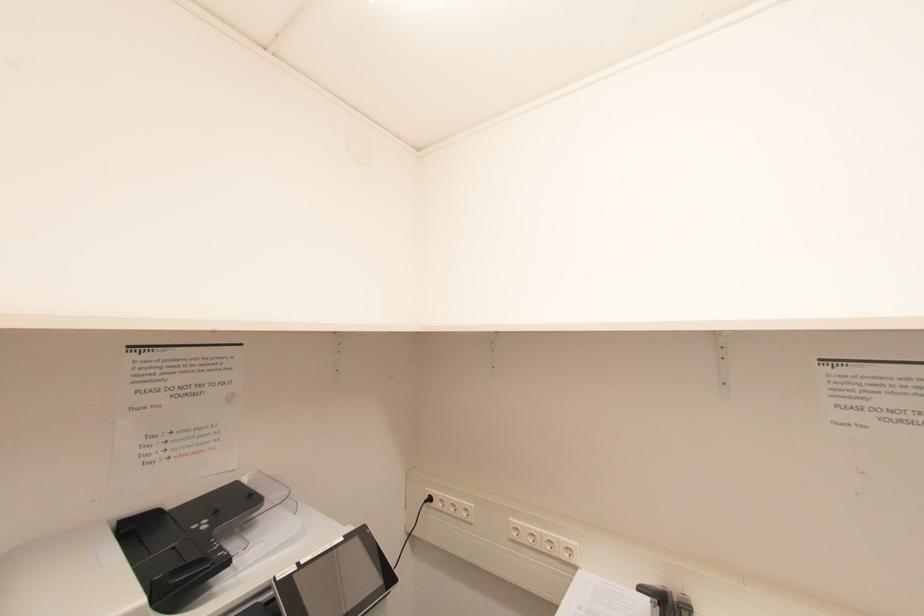
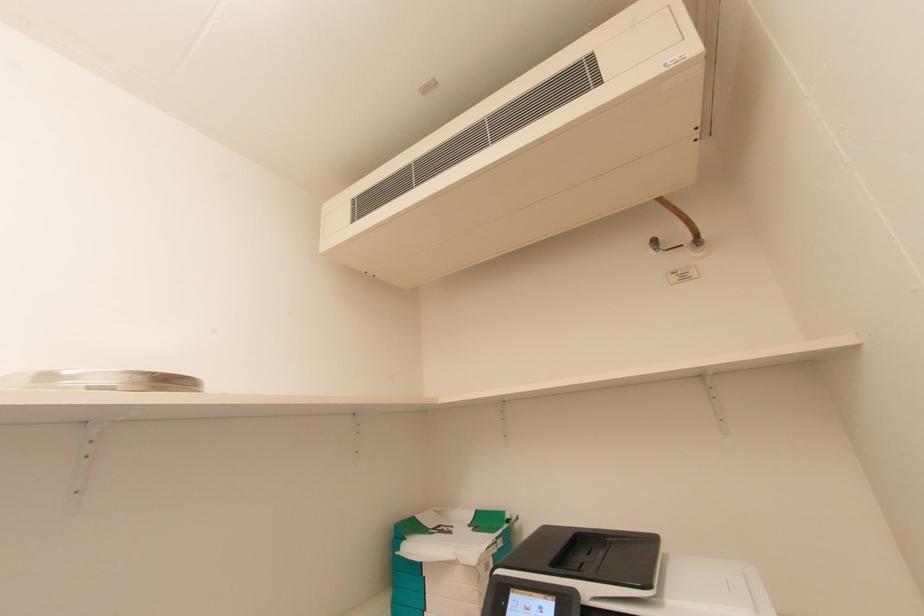
The images are taken continuously from a first-person perspective. In which direction is your viewpoint rotating?

The camera's rotation is toward right-up.